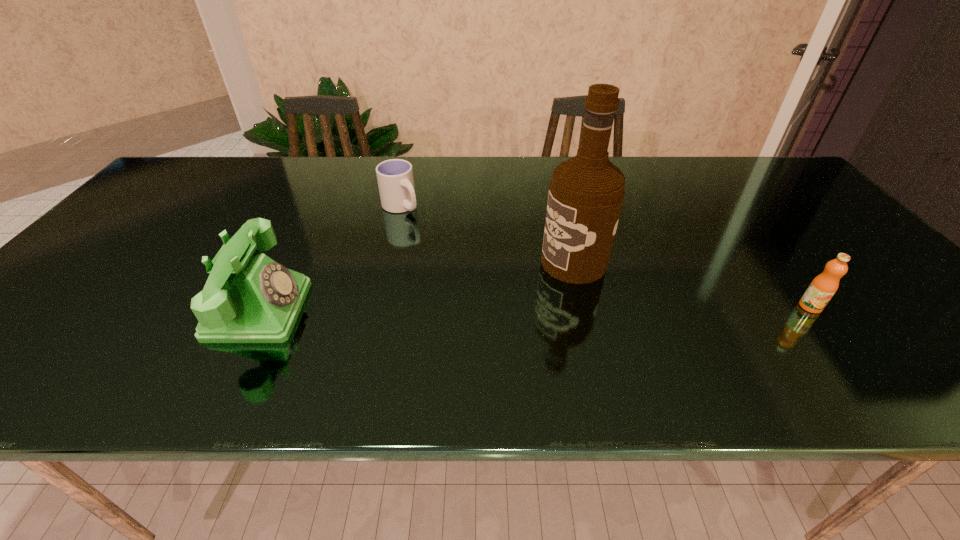
In order to click on the second tallest object in this screenshot , I will do `click(248, 298)`.

You are a GUI agent. You are given a task and a screenshot of the screen. Output one action in this format:
    pyautogui.click(x=<x>, y=<y>)
    Task: Click on the telephone
    This screenshot has height=540, width=960.
    Given the screenshot: What is the action you would take?
    pyautogui.click(x=248, y=298)

What are the coordinates of `the third tallest object` in the screenshot? It's located at 823,287.

You are a GUI agent. You are given a task and a screenshot of the screen. Output one action in this format:
    pyautogui.click(x=<x>, y=<y>)
    Task: Click on the rightmost object
    
    Given the screenshot: What is the action you would take?
    pyautogui.click(x=823, y=287)

Identify the location of cup. This screenshot has width=960, height=540. (395, 179).

Find the location of a particular element. The width and height of the screenshot is (960, 540). the third object from right to left is located at coordinates (395, 179).

I want to click on alcohol, so click(586, 193).

Where is `the third object from left to right`? This screenshot has width=960, height=540. the third object from left to right is located at coordinates click(586, 193).

Where is `vacant space located 0.230m on the dial of the third shortest object`? Image resolution: width=960 pixels, height=540 pixels. vacant space located 0.230m on the dial of the third shortest object is located at coordinates (407, 309).

What are the coordinates of `vacant area situated 0.310m with the handle on the side of the second object from left to right` in the screenshot? It's located at (473, 276).